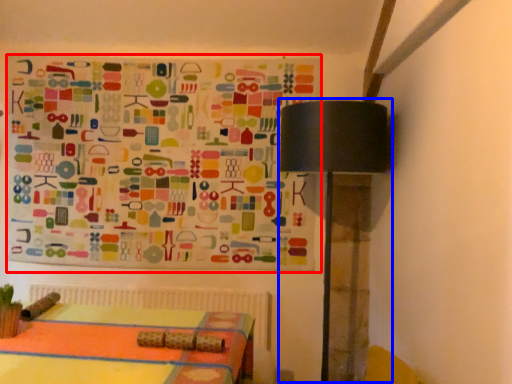
Question: Among these objects, which one is nearest to the camera, bulletin board (highlighted by a red box) or table lamp (highlighted by a blue box)?

Choices:
 (A) bulletin board
 (B) table lamp

Answer: (B)